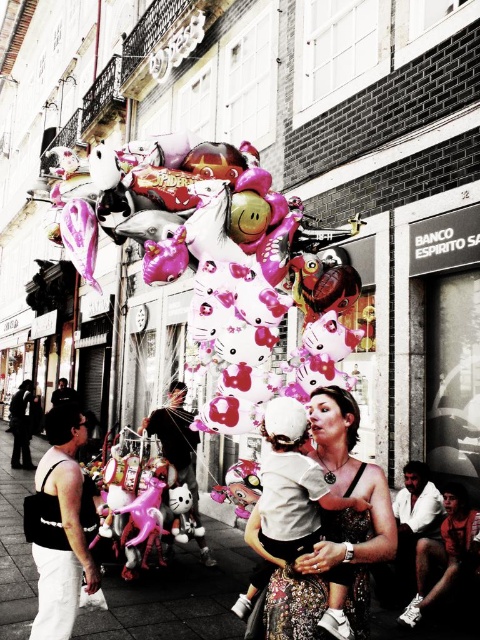
You are a photographer trying to capture a clear shot of both the matte white dress at center and the white shirt at lower right. However, you notice that one of the objects is blocking the other. Which object is in front and which is behind?

The matte white dress at center is in front of the white shirt at lower right, so the dress blocks the shirt.

You are a photographer trying to capture the scene of the child and the balloons. You notice the matte white dress at center and the white shirt at lower right in your frame. Which clothing item is positioned more to the left in the image?

The matte white dress at center is positioned more to the left compared to the white shirt at lower right.

You are a photographer standing at the center of the street. You want to take a photo that includes both the woman holding the child and the balloon vendor. The woman is at point (304, 333) and the vendor is at point (399, 516). Which point is closer to your camera position?

The point (304, 333) where the woman is located is closer to the camera than the point (399, 516) where the vendor is positioned.